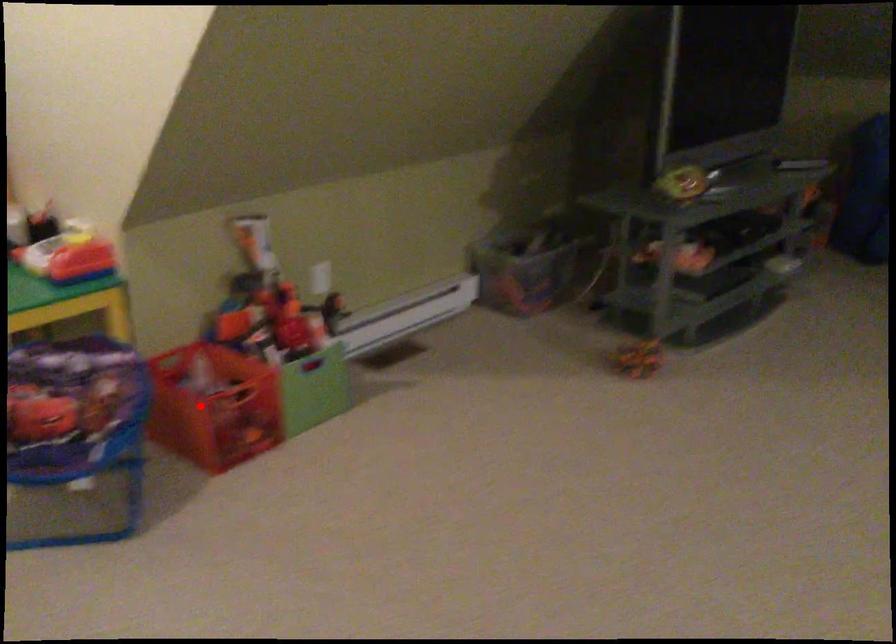
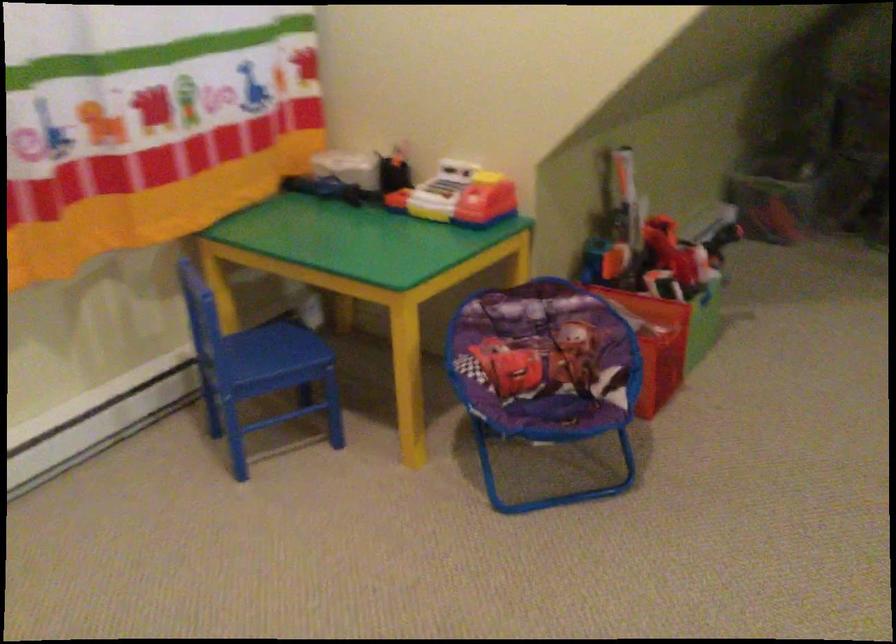
Where in the second image is the point corresponding to the highlighted location from the first image?

(653, 343)